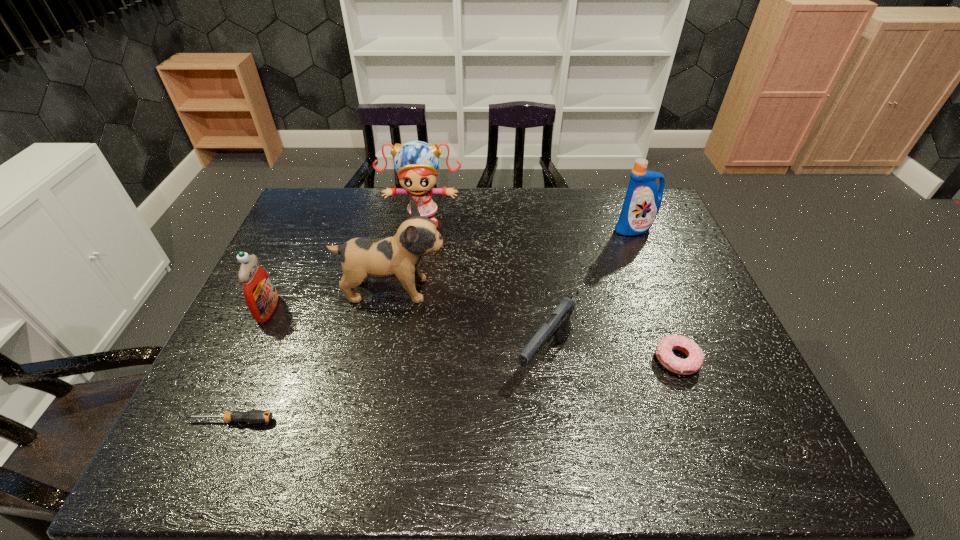
Identify the location of screwdriver. [x=253, y=416].

Locate an element on the screen. The height and width of the screenshot is (540, 960). vacant space situated on the face of the doll is located at coordinates (420, 244).

Find the location of a particular element. free space located at the face of the puppy is located at coordinates (x=549, y=290).

This screenshot has width=960, height=540. I want to click on free location located on the label of the right detergent, so click(663, 302).

Locate an element on the screen. Image resolution: width=960 pixels, height=540 pixels. blank space located on the front surface of the left detergent is located at coordinates (362, 309).

The width and height of the screenshot is (960, 540). I want to click on vacant space located at the muzzle of the fifth object from left to right, so click(x=556, y=448).

The image size is (960, 540). I want to click on free space located 0.260m on the left of the doughnut, so click(x=547, y=359).

Where is `vacant space located 0.070m on the back of the screwdriver`? This screenshot has height=540, width=960. vacant space located 0.070m on the back of the screwdriver is located at coordinates click(246, 387).

This screenshot has width=960, height=540. In order to click on doll situated at the far edge in this screenshot , I will do `click(417, 163)`.

Locate an element on the screen. This screenshot has height=540, width=960. detergent present at the far edge is located at coordinates (642, 202).